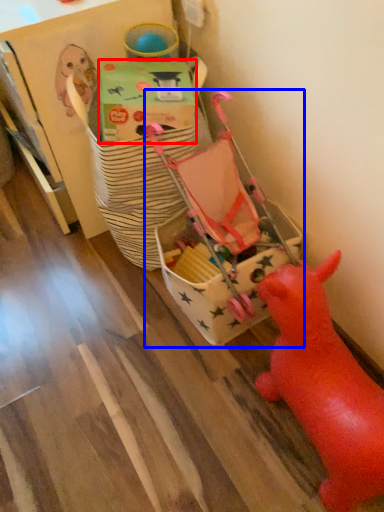
Question: Among these objects, which one is nearest to the camera, cardboard box (highlighted by a red box) or toy (highlighted by a blue box)?

Choices:
 (A) cardboard box
 (B) toy

Answer: (A)